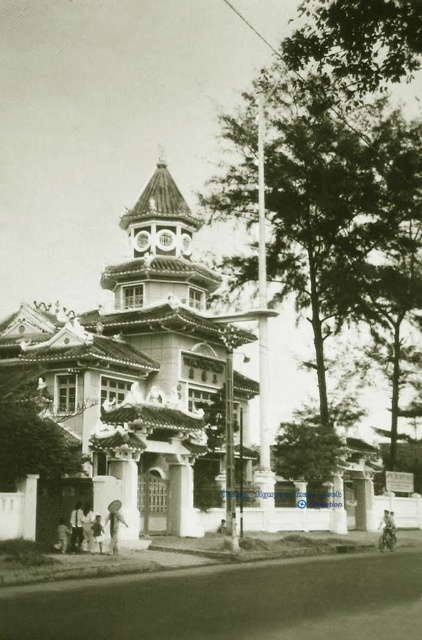
You are an architect examining this historical building. You notice the smooth stone bell tower at center and the white concrete pillar at center. Which structure is taller?

The smooth stone bell tower at center is taller than the white concrete pillar at center.

You are an architect planning to install a new security camera between the smooth stone bell tower at center and the white concrete pillar at center. The camera has a 30 meter range. Will the camera be able to cover both objects?

The smooth stone bell tower at center and white concrete pillar at center are 29.84 meters apart. Since the camera has a 30 meter range, it can cover both objects as the distance between them is within the camera range.